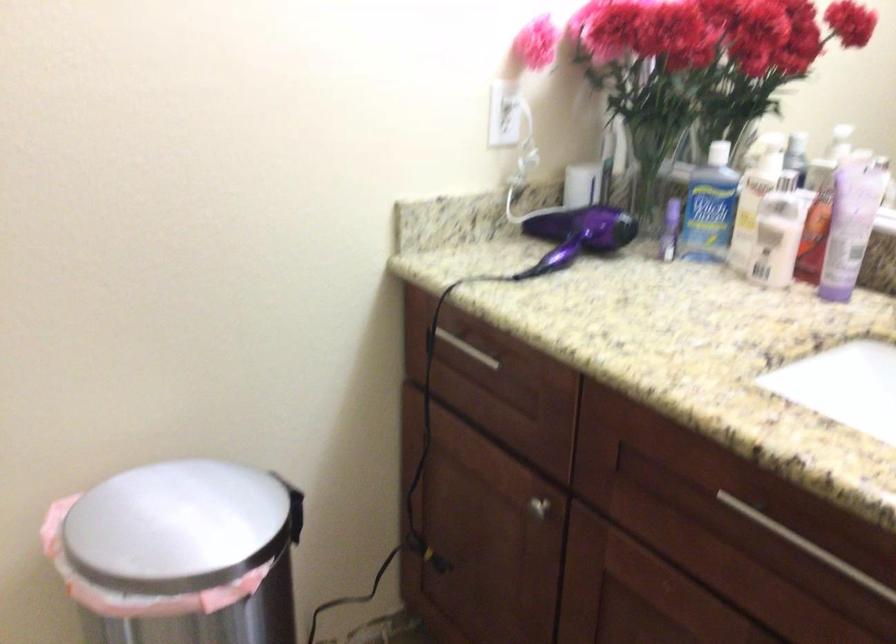
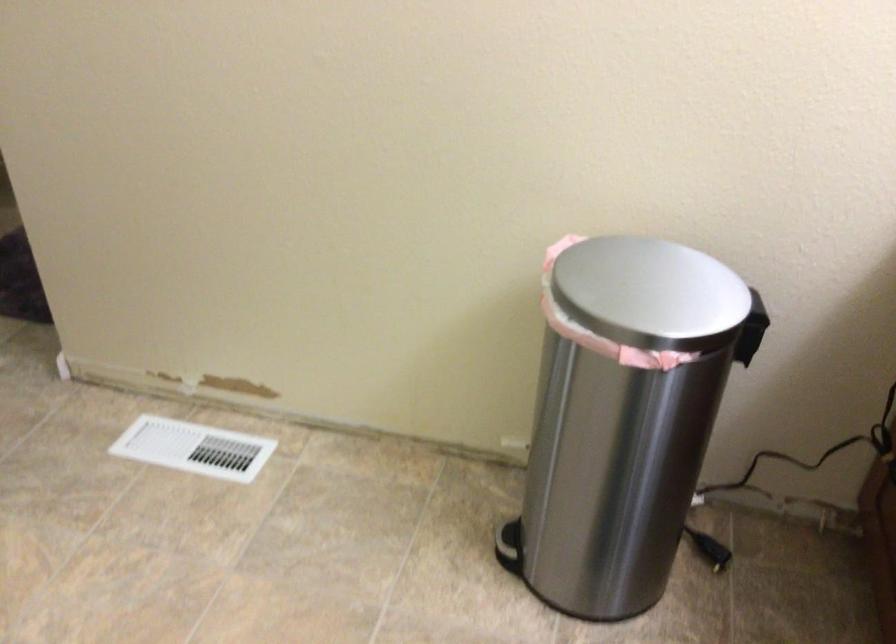
The point at (300,514) is marked in the first image. Where is the corresponding point in the second image?

(750, 337)